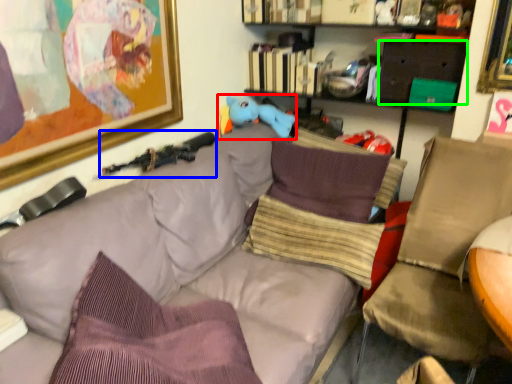
Question: Considering the real-world distances, which object is farthest from toy (highlighted by a red box)? weapon (highlighted by a blue box) or drawer (highlighted by a green box)?

Choices:
 (A) weapon
 (B) drawer

Answer: (B)